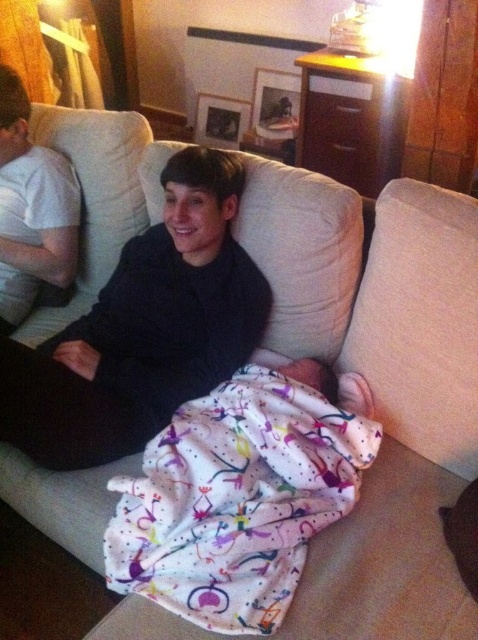
Question: Is beige fabric pillow at right above matte black sweater at left?

Choices:
 (A) yes
 (B) no

Answer: (B)

Question: Which of the following is the closest to the observer?

Choices:
 (A) black matte sweater at center
 (B) matte black sweater at left
 (C) printed fabric blanket at lower center
 (D) beige fabric pillow at right

Answer: (C)

Question: Which object is closer to the camera taking this photo?

Choices:
 (A) black matte sweater at center
 (B) beige fabric pillow at right
 (C) printed fabric blanket at lower center

Answer: (C)

Question: Is black matte sweater at center further to camera compared to beige fabric pillow at right?

Choices:
 (A) yes
 (B) no

Answer: (A)

Question: Based on their relative distances, which object is farther from the beige fabric pillow at right?

Choices:
 (A) matte black sweater at left
 (B) printed fabric blanket at lower center

Answer: (A)

Question: From the image, what is the correct spatial relationship of black matte sweater at center in relation to matte black sweater at left?

Choices:
 (A) below
 (B) above

Answer: (A)